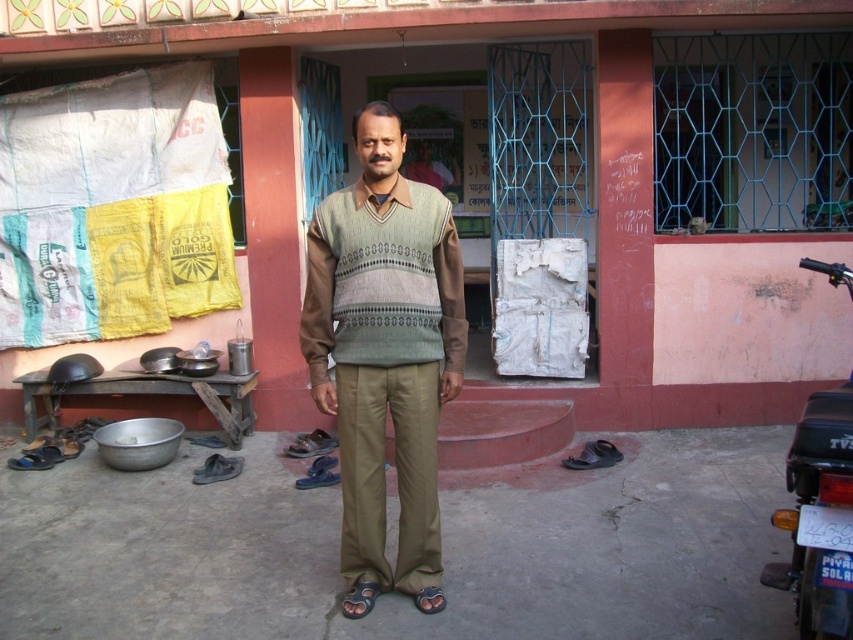
In the scene shown: You are a tailor observing a man wearing two sweaters. The man is standing in front of a building entrance with a reddish pink facade. You notice the knitted sweater at center and the knitted beige sweater at center. Which sweater is positioned lower on the man?

The knitted sweater at center is positioned lower because it is below the knitted beige sweater at center.

You are standing at the entrance of the building and want to check the position of the knitted sweater at center. According to the coordinates given, is the sweater closer to the left or right side of the image?

The knitted sweater at center is located at point 0.556 on the x and y axis, which places it closer to the right side of the image.